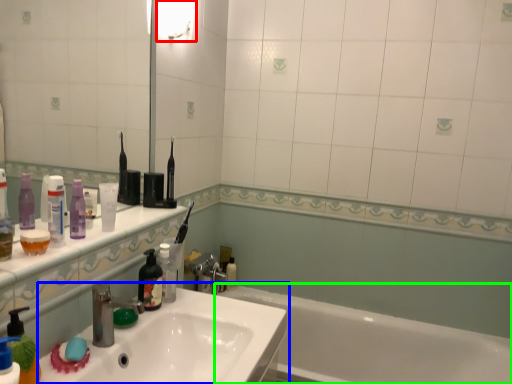
Question: Which object is positioned closest to light fixture (highlighted by a red box)? Select from sink (highlighted by a blue box) and bathtub (highlighted by a green box).

Choices:
 (A) sink
 (B) bathtub

Answer: (A)